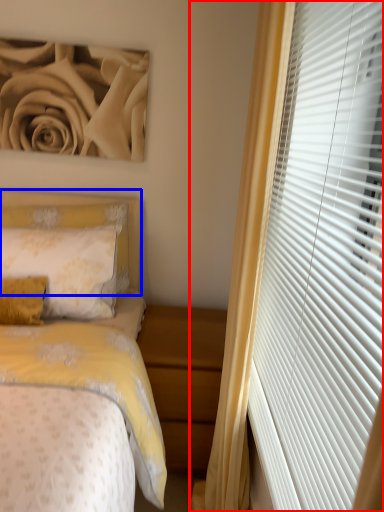
Question: Which point is closer to the camera, curtain (highlighted by a red box) or headboard (highlighted by a blue box)?

Choices:
 (A) curtain
 (B) headboard

Answer: (A)